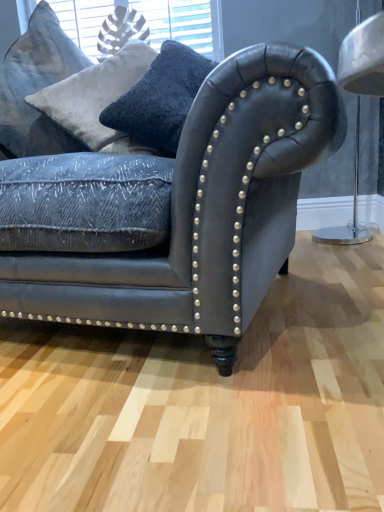
Question: Is velvety gray pillow at upper left located within matte black leather couch at center?

Choices:
 (A) no
 (B) yes

Answer: (B)

Question: Is matte black leather couch at center taller than velvety gray pillow at upper left?

Choices:
 (A) yes
 (B) no

Answer: (A)

Question: Is matte black leather couch at center at the left side of velvety gray pillow at upper left?

Choices:
 (A) no
 (B) yes

Answer: (A)

Question: Is matte black leather couch at center wider than velvety gray pillow at upper left?

Choices:
 (A) no
 (B) yes

Answer: (B)

Question: Is matte black leather couch at center not close to velvety gray pillow at upper left?

Choices:
 (A) no
 (B) yes

Answer: (A)

Question: Does matte black leather couch at center have a larger size compared to velvety gray pillow at upper left?

Choices:
 (A) no
 (B) yes

Answer: (B)

Question: Is velvety gray pillow at upper left facing towards matte black leather couch at center?

Choices:
 (A) no
 (B) yes

Answer: (A)

Question: Does velvety gray pillow at upper left have a larger size compared to matte black leather couch at center?

Choices:
 (A) yes
 (B) no

Answer: (B)

Question: Is velvety gray pillow at upper left at the left side of matte black leather couch at center?

Choices:
 (A) no
 (B) yes

Answer: (B)

Question: Considering the relative sizes of velvety gray pillow at upper left and matte black leather couch at center in the image provided, is velvety gray pillow at upper left shorter than matte black leather couch at center?

Choices:
 (A) no
 (B) yes

Answer: (B)

Question: Would you say velvety gray pillow at upper left is a long distance from matte black leather couch at center?

Choices:
 (A) no
 (B) yes

Answer: (A)

Question: Is velvety gray pillow at upper left to the right of matte black leather couch at center from the viewer's perspective?

Choices:
 (A) yes
 (B) no

Answer: (B)

Question: Is matte black leather couch at center in front of or behind velvety gray pillow at upper left in the image?

Choices:
 (A) behind
 (B) front

Answer: (B)